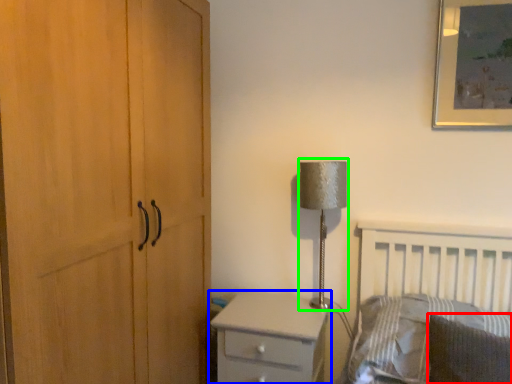
Question: Which object is positioned farthest from pillow (highlighted by a red box)? Select from chest of drawers (highlighted by a blue box) and table lamp (highlighted by a green box).

Choices:
 (A) chest of drawers
 (B) table lamp

Answer: (B)